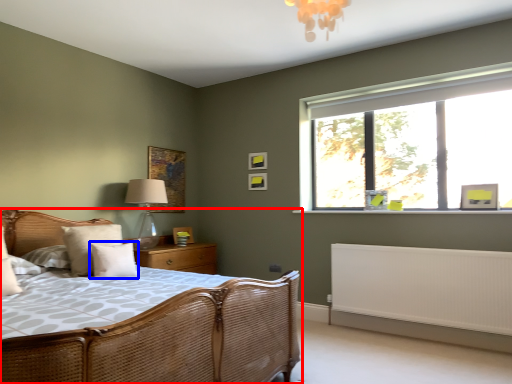
Question: Which point is closer to the camera, bed (highlighted by a red box) or pillow (highlighted by a blue box)?

Choices:
 (A) bed
 (B) pillow

Answer: (A)